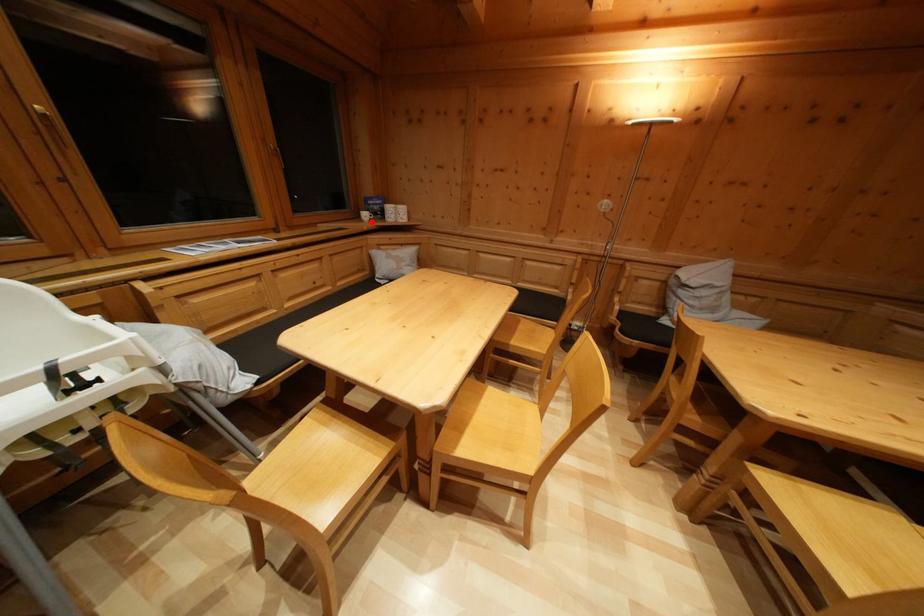
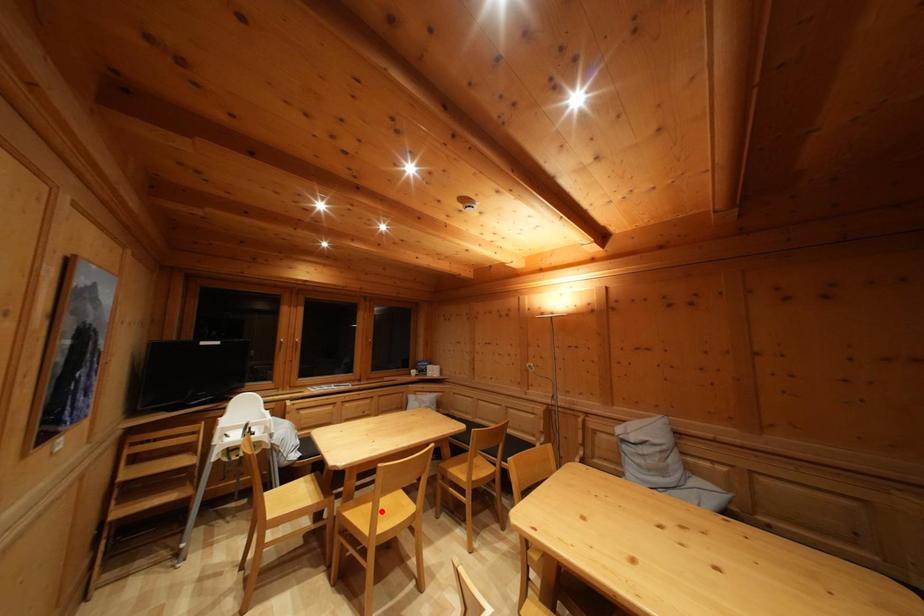
I am providing you with two images of the same scene from different viewpoints. A red point is marked on the first image and another point is marked on the second image. Is the marked point in image1 the same physical position as the marked point in image2?

No